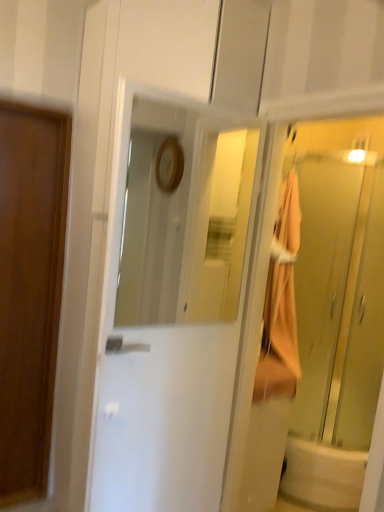
Question: Does white glossy bathtub at lower right turn towards white glossy door at center, acting as the second door starting from the back?

Choices:
 (A) yes
 (B) no

Answer: (B)

Question: Is white glossy bathtub at lower right at the right side of white glossy door at center, the 1th door from the right?

Choices:
 (A) no
 (B) yes

Answer: (B)

Question: From the image's perspective, would you say white glossy bathtub at lower right is shown under white glossy door at center, the 1th door from the right?

Choices:
 (A) yes
 (B) no

Answer: (A)

Question: Does white glossy bathtub at lower right have a greater width compared to white glossy door at center, placed as the 2th door when sorted from left to right?

Choices:
 (A) no
 (B) yes

Answer: (B)

Question: Is white glossy bathtub at lower right behind white glossy door at center, the 1th door when ordered from front to back?

Choices:
 (A) no
 (B) yes

Answer: (B)

Question: Considering their positions, is translucent glass elevator at right located in front of or behind white glossy bathtub at lower right?

Choices:
 (A) front
 (B) behind

Answer: (A)

Question: In terms of height, does translucent glass elevator at right look taller or shorter compared to white glossy bathtub at lower right?

Choices:
 (A) short
 (B) tall

Answer: (B)

Question: From a real-world perspective, is translucent glass elevator at right positioned above or below white glossy bathtub at lower right?

Choices:
 (A) above
 (B) below

Answer: (A)

Question: Is point (369, 287) closer or farther from the camera than point (345, 470)?

Choices:
 (A) farther
 (B) closer

Answer: (B)

Question: Is white glossy door at center, placed as the 2th door when sorted from left to right, taller or shorter than translucent glass elevator at right?

Choices:
 (A) tall
 (B) short

Answer: (A)

Question: Is white glossy door at center, acting as the second door starting from the back, wider or thinner than translucent glass elevator at right?

Choices:
 (A) wide
 (B) thin

Answer: (B)

Question: From the image's perspective, is white glossy door at center, the 1th door when ordered from front to back, above or below translucent glass elevator at right?

Choices:
 (A) below
 (B) above

Answer: (A)

Question: Considering their positions, is white glossy door at center, placed as the 2th door when sorted from left to right, located in front of or behind translucent glass elevator at right?

Choices:
 (A) behind
 (B) front

Answer: (B)

Question: Is wooden door at left, which ranks as the 1th door in left-to-right order, in front of or behind translucent glass elevator at right in the image?

Choices:
 (A) front
 (B) behind

Answer: (A)

Question: In terms of height, does wooden door at left, which is the second door in right-to-left order, look taller or shorter compared to translucent glass elevator at right?

Choices:
 (A) tall
 (B) short

Answer: (A)